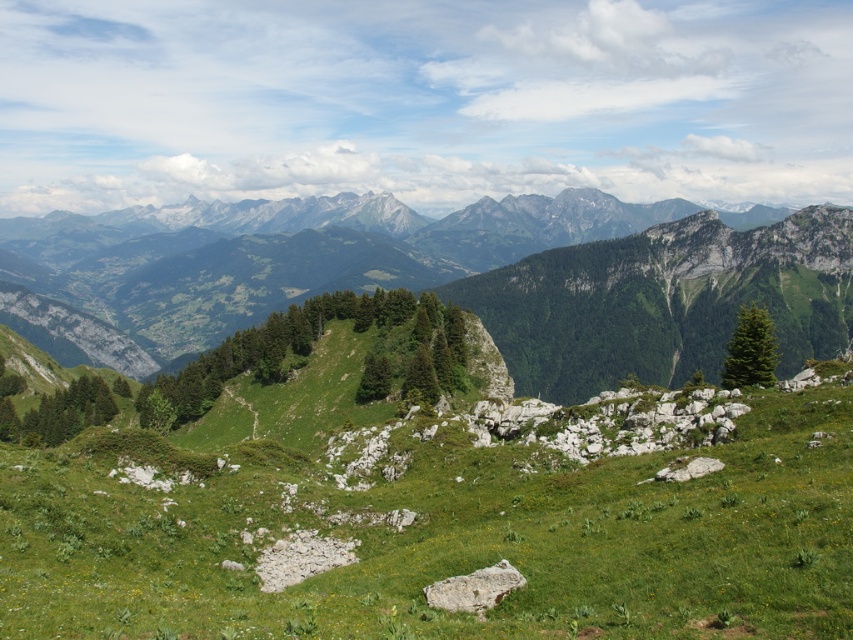
Based on the scene description, what is located at the coordinates point (460, 449)?

The point (460, 449) is located at the green grassy hillside at center.

You are a hiker planning to traverse the area shown in the image. You need to decide between two paths. One path follows the green grassy hillside at center, and the other follows the green grassy mountain range at upper center. Based on their widths, which path would you choose for better stability and why?

The green grassy hillside at center is thinner than the green grassy mountain range at upper center. Therefore, the path along the green grassy mountain range at upper center is wider and offers better stability for hiking.

You are a hiker planning to take a photo of the green grassy hillside at center and the green grassy mountain range at upper center. Which of the two should you focus on first if you want to capture both in a single frame without moving your camera?

You should focus on the green grassy mountain range at upper center first because it is larger and will occupy more of the frame, ensuring it is properly captured before adjusting for the smaller green grassy hillside at center.